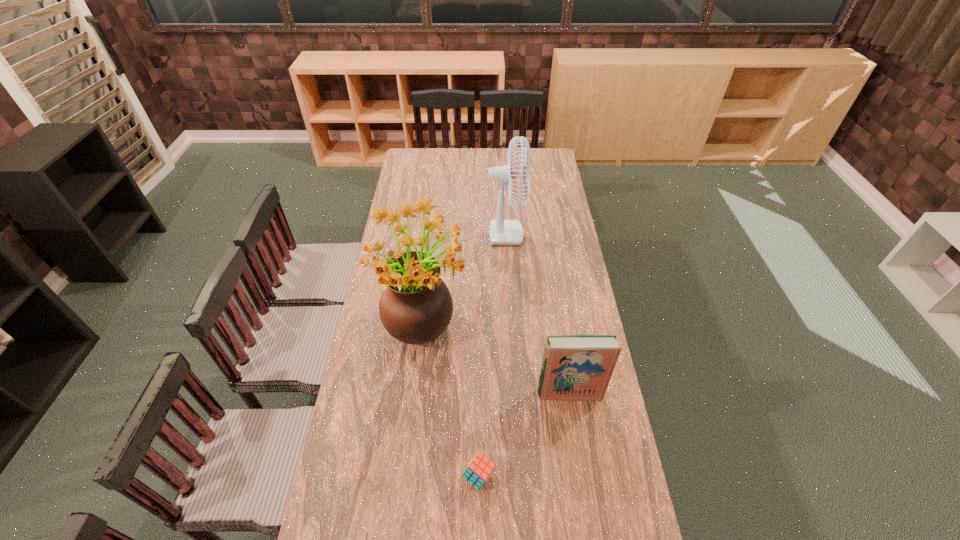
Locate an element on the screen. This screenshot has height=540, width=960. free space between the flower arrangement and the cube is located at coordinates (452, 399).

Locate an element on the screen. The image size is (960, 540). blank region between the fan and the third tallest object is located at coordinates (524, 309).

Locate an element on the screen. The width and height of the screenshot is (960, 540). empty space between the flower arrangement and the cube is located at coordinates (452, 399).

The image size is (960, 540). I want to click on object that ranks as the second closest to the third farthest object, so click(415, 307).

This screenshot has height=540, width=960. I want to click on object that is the second nearest to the shortest object, so click(x=415, y=307).